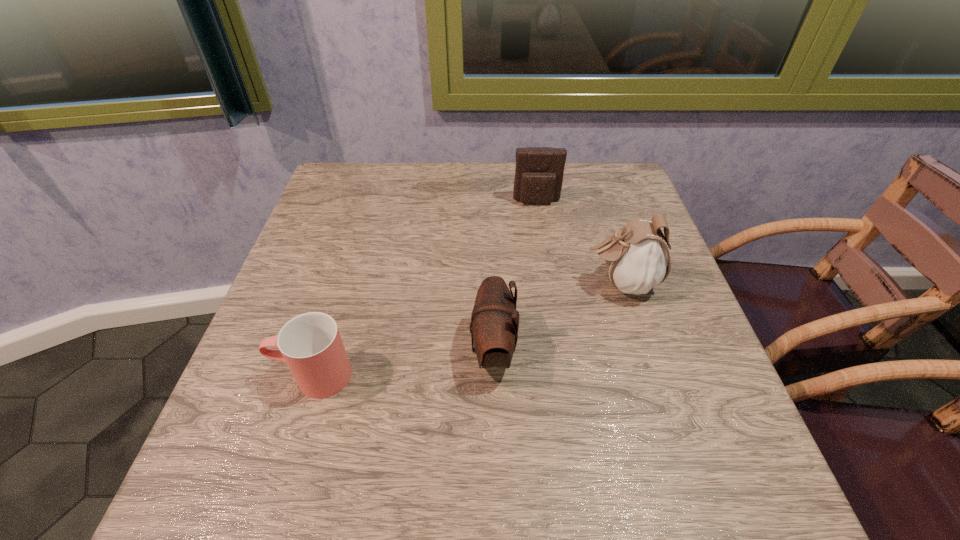
At what (x,y) coordinates should I click in order to perform the action: click on vacant space located 0.120m on the front-facing side of the rightmost pouch. Please return your answer as a coordinate pair (x, y). The width and height of the screenshot is (960, 540). Looking at the image, I should click on (527, 284).

This screenshot has height=540, width=960. I want to click on vacant space located 0.320m with an open flap on the farthest pouch, so click(552, 302).

Find the location of a particular element. Image resolution: width=960 pixels, height=540 pixels. vacant space located 0.260m with the flap open on the second object from left to right is located at coordinates (328, 350).

Locate an element on the screen. vacant area situated with the flap open on the second object from left to right is located at coordinates (350, 350).

The height and width of the screenshot is (540, 960). I want to click on free location located 0.220m with the flap open on the second object from left to right, so point(350,350).

Locate an element on the screen. The width and height of the screenshot is (960, 540). vacant space positioned 0.060m on the side of the cup with the handle is located at coordinates (241, 375).

Locate an element on the screen. This screenshot has width=960, height=540. object present at the far edge is located at coordinates (539, 171).

You are a GUI agent. You are given a task and a screenshot of the screen. Output one action in this format:
    pyautogui.click(x=<x>, y=<y>)
    Task: Click on the object situated at the left edge
    The image size is (960, 540).
    Given the screenshot: What is the action you would take?
    pyautogui.click(x=310, y=344)

Locate an element on the screen. This screenshot has width=960, height=540. object at the right edge is located at coordinates (637, 257).

At what (x,y) coordinates should I click in order to perform the action: click on free space at the far edge of the desktop. Please return your answer as a coordinate pair (x, y). The image size is (960, 540). Looking at the image, I should click on (425, 172).